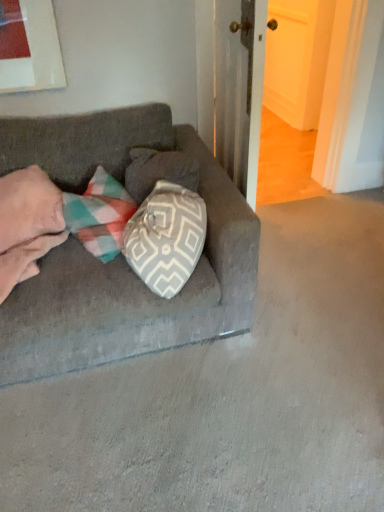
This screenshot has width=384, height=512. What do you see at coordinates (27, 224) in the screenshot? I see `pink soft blanket at left` at bounding box center [27, 224].

The height and width of the screenshot is (512, 384). In order to click on pink soft blanket at left in this screenshot , I will do `click(27, 224)`.

What is the approximate width of pink soft blanket at left?

pink soft blanket at left is 38.87 centimeters in width.

Measure the distance between velvet gray couch at center and camera.

They are 5.10 feet apart.

Where is `velvet gray couch at center`? velvet gray couch at center is located at coordinates (120, 255).

The width and height of the screenshot is (384, 512). What do you see at coordinates (120, 255) in the screenshot? I see `velvet gray couch at center` at bounding box center [120, 255].

Where is `pink soft blanket at left`? The height and width of the screenshot is (512, 384). pink soft blanket at left is located at coordinates (27, 224).

Considering the positions of objects velvet gray couch at center and pink soft blanket at left in the image provided, who is more to the right, velvet gray couch at center or pink soft blanket at left?

From the viewer's perspective, velvet gray couch at center appears more on the right side.

Considering the positions of objects velvet gray couch at center and pink soft blanket at left in the image provided, who is in front, velvet gray couch at center or pink soft blanket at left?

velvet gray couch at center is in front.

Is point (54, 359) closer to camera compared to point (12, 213)?

Yes, point (54, 359) is in front of point (12, 213).

From the picture: From the image's perspective, between velvet gray couch at center and pink soft blanket at left, who is located below?

velvet gray couch at center, from the image's perspective.

From a real-world perspective, relative to pink soft blanket at left, is velvet gray couch at center vertically above or below?

From a real-world perspective, velvet gray couch at center is physically below pink soft blanket at left.

Between velvet gray couch at center and pink soft blanket at left, which one has smaller width?

Thinner between the two is pink soft blanket at left.

Does velvet gray couch at center have a lesser height compared to pink soft blanket at left?

Incorrect, the height of velvet gray couch at center does not fall short of that of pink soft blanket at left.

Considering the sizes of objects velvet gray couch at center and pink soft blanket at left in the image provided, who is bigger, velvet gray couch at center or pink soft blanket at left?

velvet gray couch at center.

Could pink soft blanket at left be considered to be inside velvet gray couch at center?

Yes, velvet gray couch at center contains pink soft blanket at left.

Looking at this image, are velvet gray couch at center and pink soft blanket at left beside each other?

velvet gray couch at center and pink soft blanket at left are clearly separated.

Is velvet gray couch at center facing towards pink soft blanket at left?

No.

How many degrees apart are the facing directions of velvet gray couch at center and pink soft blanket at left?

They differ by 23.4 degrees in their facing directions.

Based on the photo, measure the distance from velvet gray couch at center to pink soft blanket at left.

30.26 centimeters.

What are the coordinates of `couple above the velvet gray couch at center (from a real-world perspective)` in the screenshot? It's located at (27, 224).

Is pink soft blanket at left at the left side of velvet gray couch at center?

Yes, pink soft blanket at left is to the left of velvet gray couch at center.

Considering the relative positions of pink soft blanket at left and velvet gray couch at center in the image provided, is pink soft blanket at left in front of velvet gray couch at center?

No, it is not.

Which is in front, point (40, 226) or point (220, 292)?

Point (220, 292)

From the image's perspective, which is above, pink soft blanket at left or velvet gray couch at center?

pink soft blanket at left appears higher in the image.

From a real-world perspective, which is physically above, pink soft blanket at left or velvet gray couch at center?

From a 3D spatial view, pink soft blanket at left is above.

Consider the image. Does pink soft blanket at left have a greater width compared to velvet gray couch at center?

In fact, pink soft blanket at left might be narrower than velvet gray couch at center.

Which of these two, pink soft blanket at left or velvet gray couch at center, stands shorter?

With less height is pink soft blanket at left.

Between pink soft blanket at left and velvet gray couch at center, which one has smaller size?

Smaller between the two is pink soft blanket at left.

Is velvet gray couch at center a part of pink soft blanket at left?

No, velvet gray couch at center is located outside of pink soft blanket at left.

Are pink soft blanket at left and velvet gray couch at center making contact?

No, pink soft blanket at left is not touching velvet gray couch at center.

Is pink soft blanket at left facing towards velvet gray couch at center?

Yes, pink soft blanket at left is aimed at velvet gray couch at center.

Find the location of `studio couch that appears on the right of pink soft blanket at left`. studio couch that appears on the right of pink soft blanket at left is located at coordinates (120, 255).

Locate an element on the screen. This screenshot has width=384, height=512. couple that is above the velvet gray couch at center (from the image's perspective) is located at coordinates (27, 224).

This screenshot has width=384, height=512. In order to click on studio couch below the pink soft blanket at left (from the image's perspective) in this screenshot , I will do `click(120, 255)`.